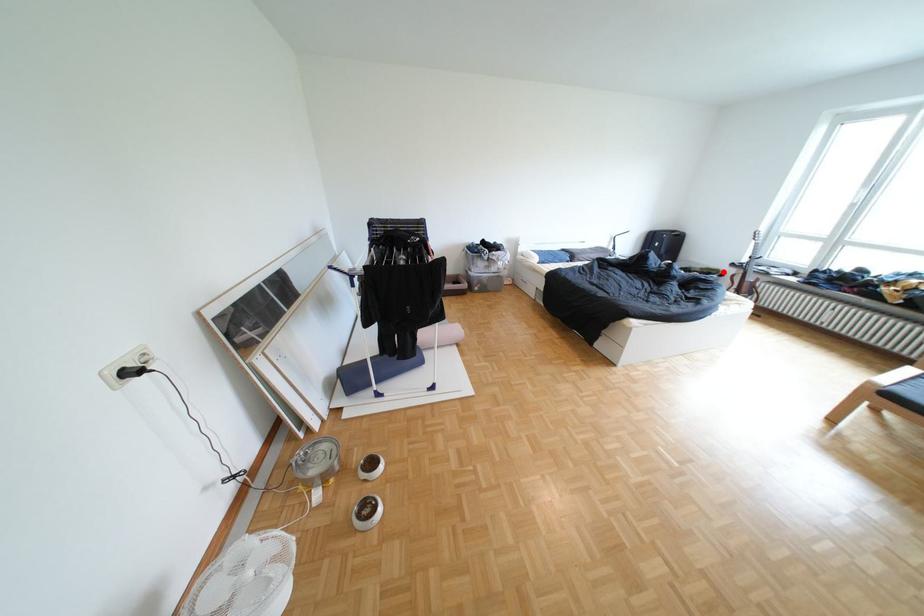
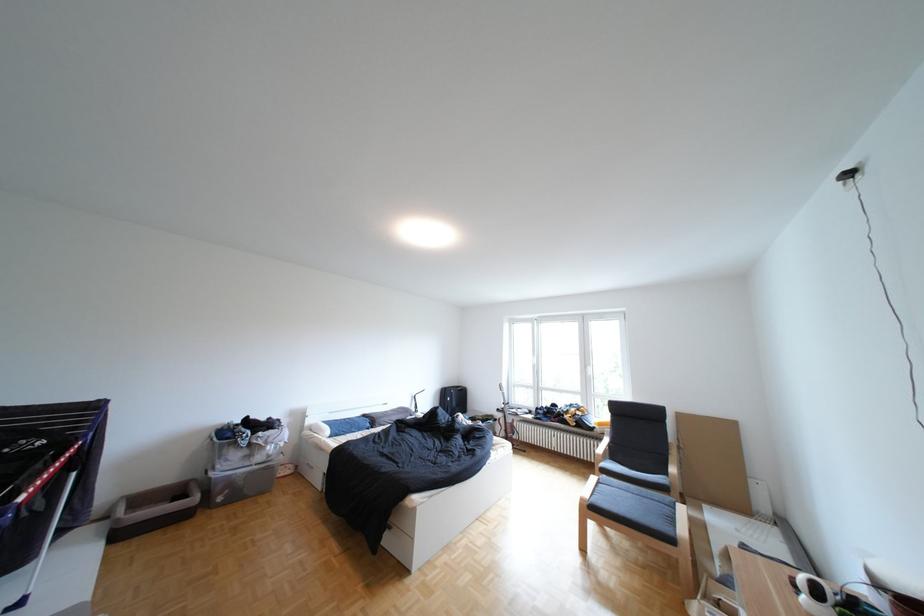
Question: I am providing you with two images of the same scene from different viewpoints. Given a red point in image1, look at the same physical point in image2. Is it:

Choices:
 (A) Closer to the viewpoint
 (B) Farther from the viewpoint

Answer: (B)